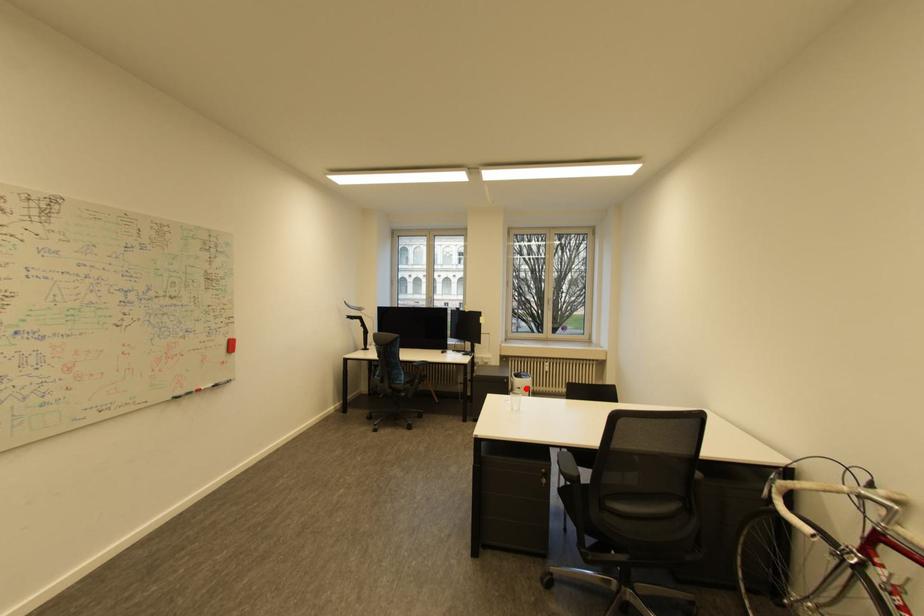
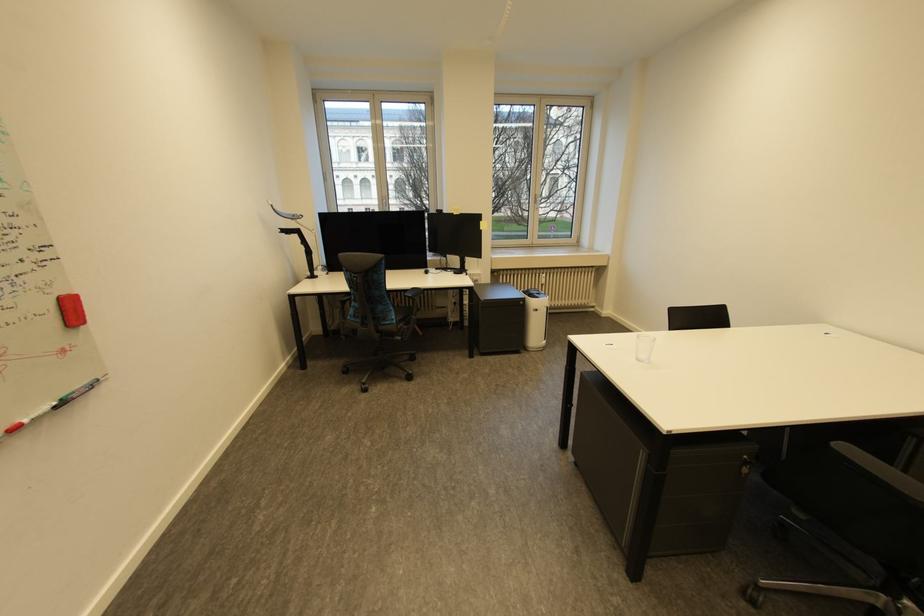
Locate, in the second image, the point that corresponds to the highlighted location in the first image.

(543, 310)